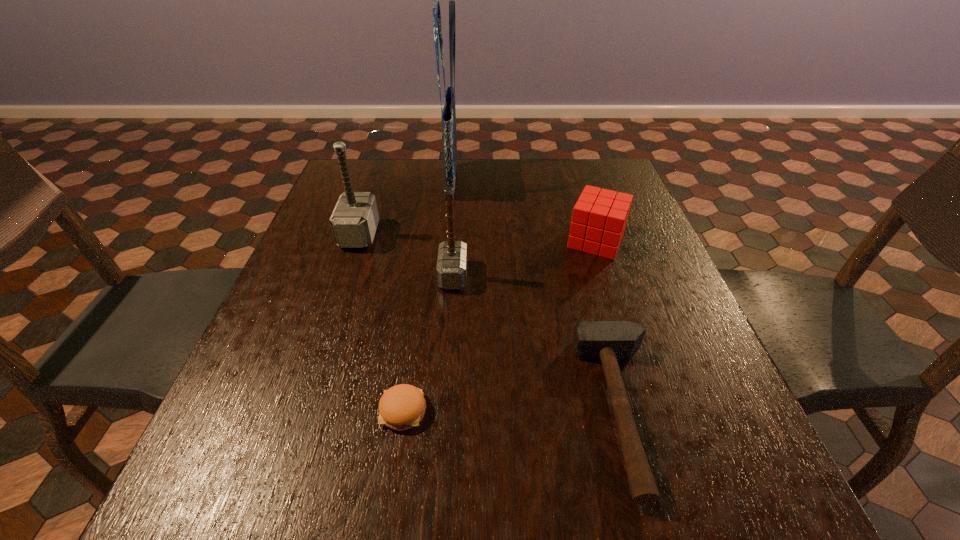
Identify the location of vacant area between the farthest object and the patty. This screenshot has height=540, width=960. (427, 296).

The height and width of the screenshot is (540, 960). I want to click on free spot between the second hammer from left to right and the rightmost hammer, so pyautogui.click(x=539, y=343).

Identify the location of empty space that is in between the cube and the second hammer from left to right. This screenshot has width=960, height=540. (524, 258).

The width and height of the screenshot is (960, 540). I want to click on unoccupied position between the shortest object and the fifth tallest object, so click(x=514, y=410).

I want to click on vacant area that lies between the patty and the third shortest object, so click(x=499, y=326).

This screenshot has width=960, height=540. In order to click on object that is the fourth closest to the leftmost object in this screenshot , I will do `click(599, 218)`.

Identify which object is located as the fifth nearest to the second shortest object. Please provide its 2D coordinates. Your answer should be formatted as a tuple, i.e. [(x, y)], where the tuple contains the x and y coordinates of a point satisfying the conditions above.

[(448, 116)]

Select which hammer is the closest to the leftmost hammer. Please provide its 2D coordinates. Your answer should be formatted as a tuple, i.e. [(x, y)], where the tuple contains the x and y coordinates of a point satisfying the conditions above.

[(451, 269)]

Identify which hammer is the second closest to the leftmost object. Please provide its 2D coordinates. Your answer should be formatted as a tuple, i.e. [(x, y)], where the tuple contains the x and y coordinates of a point satisfying the conditions above.

[(608, 341)]

Image resolution: width=960 pixels, height=540 pixels. Find the location of `free space that satisfies the following two spatial constraints: 1. on the front-facing side of the cube; 2. on the right side of the tallest object`. free space that satisfies the following two spatial constraints: 1. on the front-facing side of the cube; 2. on the right side of the tallest object is located at coordinates (446, 241).